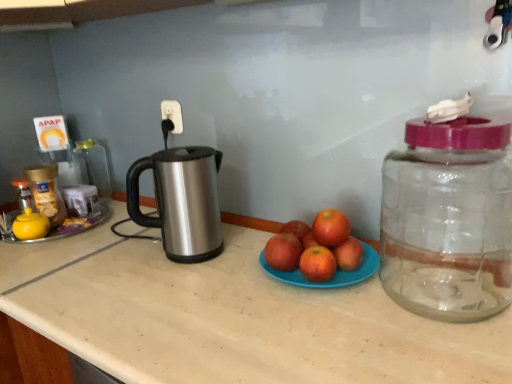
Question: Is red matte apple at center, which is the first apple in left-to-right order, positioned in front of transparent plastic bottle at left, which is the 2th bottle from left to right?

Choices:
 (A) yes
 (B) no

Answer: (A)

Question: Does red matte apple at center, which is the first apple in left-to-right order, contain transparent plastic bottle at left, the 3th bottle viewed from the front?

Choices:
 (A) yes
 (B) no

Answer: (B)

Question: Can you confirm if red matte apple at center, which is the 2th apple from right to left, is positioned to the left of transparent plastic bottle at left, acting as the second bottle starting from the right?

Choices:
 (A) no
 (B) yes

Answer: (A)

Question: From a real-world perspective, is red matte apple at center, which is the 2th apple from right to left, positioned under transparent plastic bottle at left, the 3th bottle viewed from the front, based on gravity?

Choices:
 (A) yes
 (B) no

Answer: (A)

Question: Is red matte apple at center, which is the first apple in left-to-right order, thinner than transparent plastic bottle at left, the 3th bottle viewed from the front?

Choices:
 (A) no
 (B) yes

Answer: (B)

Question: From a real-world perspective, is orange matte grapefruit at center, which ranks as the 1th grapefruit in bottom-to-top order, above or below gold plastic jar at left, the 2th bottle viewed from the back?

Choices:
 (A) above
 (B) below

Answer: (B)

Question: From the image's perspective, is orange matte grapefruit at center, which is the second grapefruit in top-to-bottom order, positioned above or below gold plastic jar at left, marked as the 1th bottle in a left-to-right arrangement?

Choices:
 (A) below
 (B) above

Answer: (A)

Question: Visually, is orange matte grapefruit at center, which is the second grapefruit in top-to-bottom order, positioned to the left or to the right of gold plastic jar at left, acting as the 2th bottle starting from the front?

Choices:
 (A) right
 (B) left

Answer: (A)

Question: In terms of width, does orange matte grapefruit at center, which ranks as the 1th grapefruit in bottom-to-top order, look wider or thinner when compared to gold plastic jar at left, acting as the 2th bottle starting from the front?

Choices:
 (A) thin
 (B) wide

Answer: (A)

Question: Would you say red matte apple at center, which is the first apple in left-to-right order, is inside or outside gold plastic jar at left, the 3th bottle viewed from the right?

Choices:
 (A) inside
 (B) outside

Answer: (B)

Question: Considering their positions, is red matte apple at center, which is the first apple in left-to-right order, located in front of or behind gold plastic jar at left, the 3th bottle viewed from the right?

Choices:
 (A) front
 (B) behind

Answer: (A)

Question: Considering the positions of red matte apple at center, which is the first apple in left-to-right order, and gold plastic jar at left, the 3th bottle viewed from the right, in the image, is red matte apple at center, which is the first apple in left-to-right order, wider or thinner than gold plastic jar at left, the 3th bottle viewed from the right,?

Choices:
 (A) thin
 (B) wide

Answer: (A)

Question: Based on their sizes in the image, would you say red matte apple at center, which is the first apple in left-to-right order, is bigger or smaller than gold plastic jar at left, acting as the 2th bottle starting from the front?

Choices:
 (A) small
 (B) big

Answer: (A)

Question: Is transparent plastic jar at right, the first bottle positioned from the right, in front of or behind beige laminate countertop at center in the image?

Choices:
 (A) front
 (B) behind

Answer: (B)

Question: Does point (393, 162) appear closer or farther from the camera than point (17, 274)?

Choices:
 (A) closer
 (B) farther

Answer: (A)